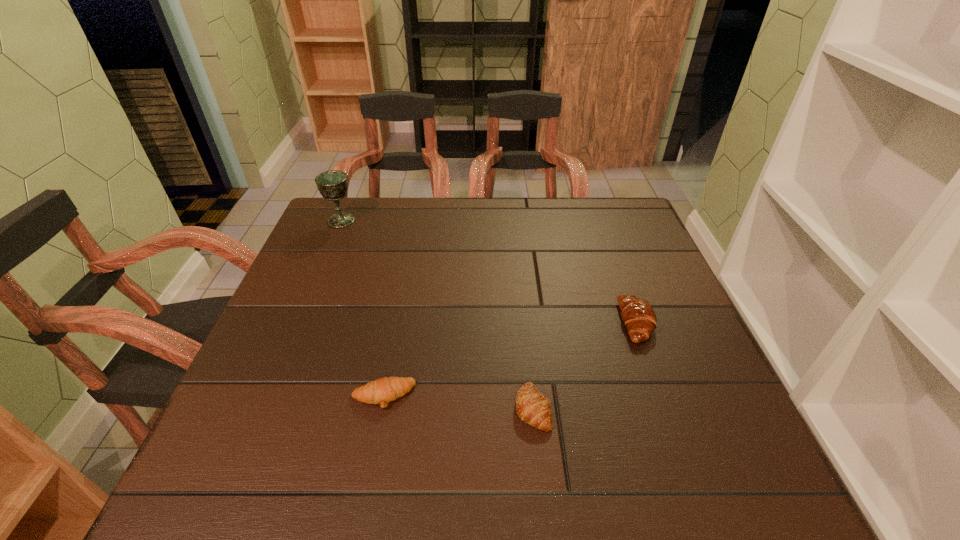
Select which crescent roll appears as the second closest to the farthest crescent roll. Please provide its 2D coordinates. Your answer should be formatted as a tuple, i.e. [(x, y)], where the tuple contains the x and y coordinates of a point satisfying the conditions above.

[(381, 391)]

The image size is (960, 540). I want to click on the second closest crescent roll to the second object from right to left, so click(x=637, y=314).

The image size is (960, 540). What are the coordinates of `vacant area in the image that satisfies the following two spatial constraints: 1. on the front side of the second crescent roll from right to left; 2. on the left side of the second object from left to right` in the screenshot? It's located at (381, 408).